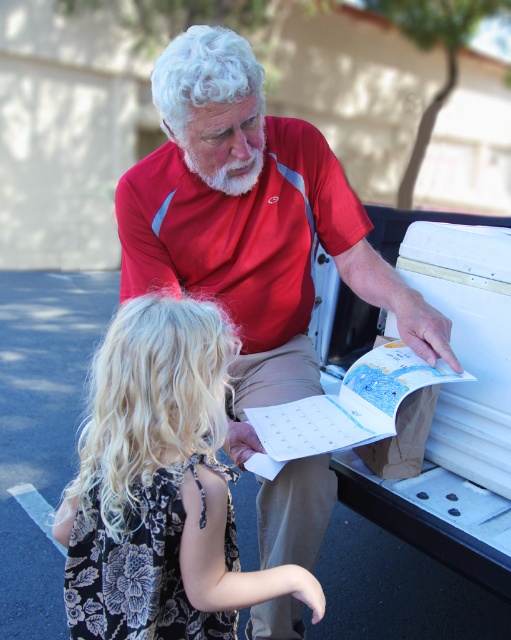
Between red matte shirt at upper center and whitehairbeard at center, which one is positioned higher?

whitehairbeard at center is higher up.

Is red matte shirt at upper center behind whitehairbeard at center?

No, it is not.

Who is more forward, (229, 420) or (193, 150)?

Point (193, 150) is more forward.

In order to click on red matte shirt at upper center in this screenshot , I will do `click(251, 225)`.

Does black floral dress at lower left appear on the right side of whitehairbeard at center?

No, black floral dress at lower left is not to the right of whitehairbeard at center.

This screenshot has width=511, height=640. In order to click on black floral dress at lower left in this screenshot , I will do `click(159, 486)`.

Is red matte shirt at upper center smaller than red polyester polo shirt at upper center?

No.

Between red matte shirt at upper center and red polyester polo shirt at upper center, which one has more height?

With more height is red matte shirt at upper center.

Locate an element on the screen. red matte shirt at upper center is located at coordinates (251, 225).

Find the location of a particular element. The image size is (511, 640). red matte shirt at upper center is located at coordinates (251, 225).